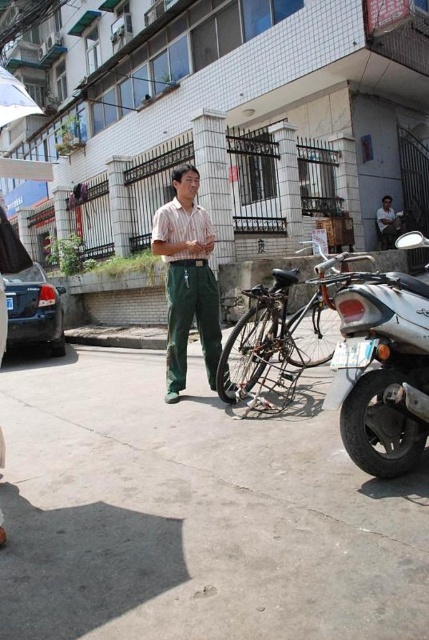
You are a delivery driver who needs to park your motorcycle between the silver metallic motorcycle at lower right and the striped fabric shirt at center. Can you fit your motorcycle there if your motorcycle is 1.2 meters wide?

The silver metallic motorcycle at lower right has a lesser width compared to striped fabric shirt at center. Since the silver metallic motorcycle at lower right is narrower than the striped fabric shirt at center, the space between them may be sufficient for your 1.2 meter wide motorcycle. However, without exact measurements of the gap, it is uncertain. It depends on how much space exists between the two objects.

You are a delivery person who needs to place a package on the ground. You see the gray concrete pavement at center and the white fabric umbrella at upper left. Which surface is lower to the ground and suitable for placing the package?

The gray concrete pavement at center is shorter than the white fabric umbrella at upper left, so it is lower to the ground and suitable for placing the package.

Based on the scene, which object is bigger when viewed from the perspective of someone standing in front of the striped fabric shirt at center and matte green pants at center?

The striped fabric shirt at center is larger in size than the matte green pants at center, so the striped fabric shirt at center is bigger.